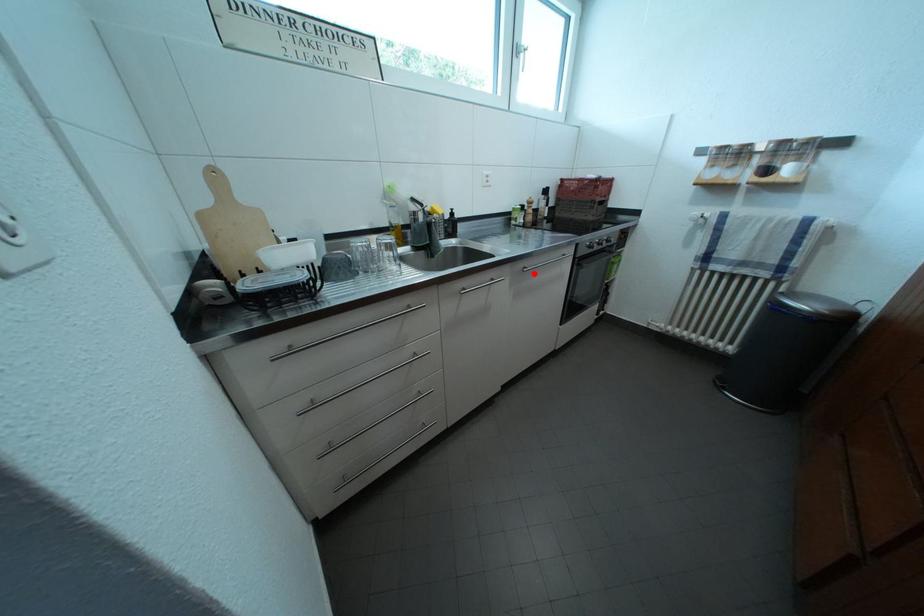
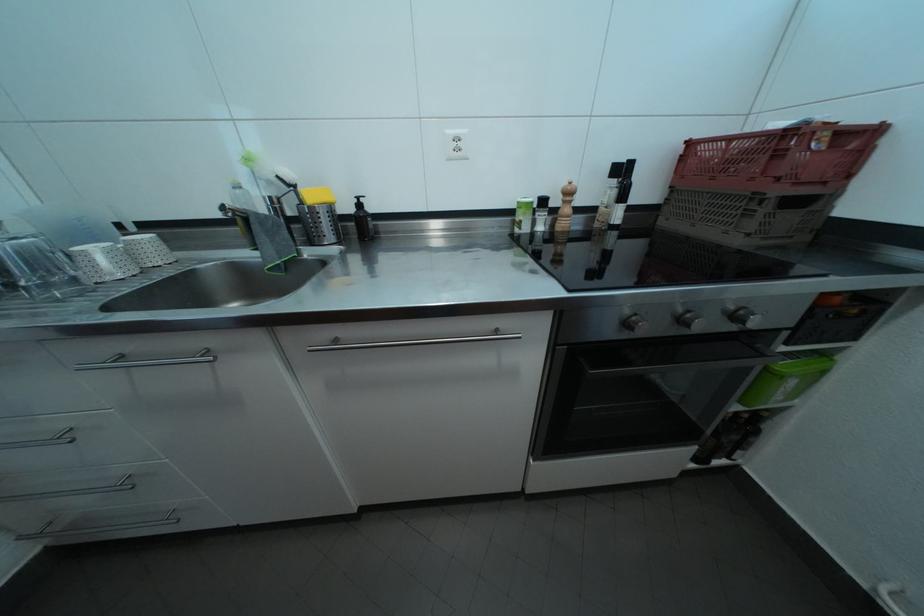
Locate, in the second image, the point that corresponds to the highlighted location in the first image.

(346, 347)